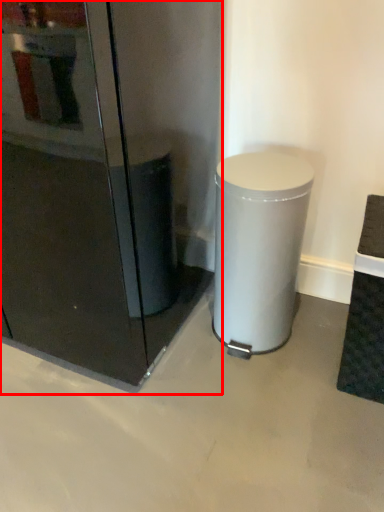
Question: In this image, where is fridge (annotated by the red box) located relative to waste container?

Choices:
 (A) left
 (B) right

Answer: (A)